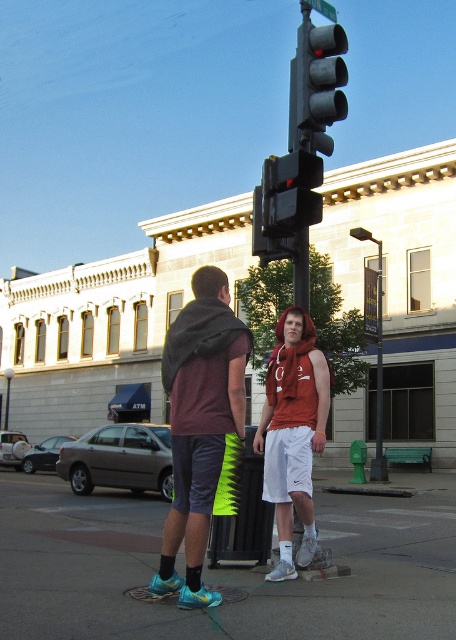
You are standing at the point marked by coordinates (202, 428) in the image. Looking around, you see a matte maroon t shirt at center. What object is located exactly at your current position?

The matte maroon t shirt at center is located exactly at the point marked by coordinates (202, 428).

You are standing at the point with coordinates point (x=316, y=83). Looking around, you see a metallic gray traffic light at upper center. Which direction should you face to look towards the traffic light?

You should face towards the traffic light at upper center because the point (x=316, y=83) is located on it, meaning you are already at the traffic light.